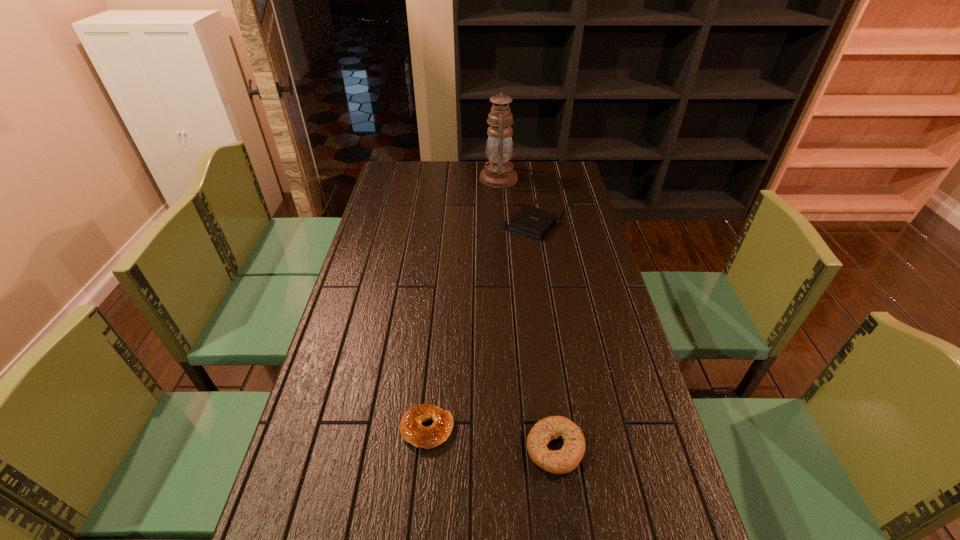
At what (x,y) coordinates should I click in order to perform the action: click on the farthest object. Please return your answer as a coordinate pair (x, y). The height and width of the screenshot is (540, 960). Looking at the image, I should click on (498, 173).

This screenshot has height=540, width=960. I want to click on oil lamp, so click(x=498, y=173).

Where is `the third nearest object`? The height and width of the screenshot is (540, 960). the third nearest object is located at coordinates (530, 222).

Locate an element on the screen. This screenshot has width=960, height=540. the third shortest object is located at coordinates (530, 222).

Locate an element on the screen. This screenshot has height=540, width=960. the right bagel is located at coordinates (562, 461).

Where is `the left bagel`? This screenshot has height=540, width=960. the left bagel is located at coordinates (411, 430).

Find the location of a particular element. the shortest object is located at coordinates (411, 430).

Find the location of a particular element. The image size is (960, 540). vacant space located 0.330m on the left of the farthest object is located at coordinates (405, 179).

Where is `vacant space situated 0.160m on the left of the third nearest object`? The width and height of the screenshot is (960, 540). vacant space situated 0.160m on the left of the third nearest object is located at coordinates (464, 226).

Where is `free region located on the back of the right bagel`? The width and height of the screenshot is (960, 540). free region located on the back of the right bagel is located at coordinates (542, 353).